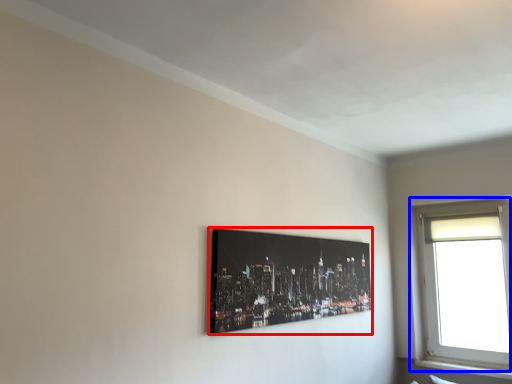
Question: Which object is further to the camera taking this photo, picture frame (highlighted by a red box) or window (highlighted by a blue box)?

Choices:
 (A) picture frame
 (B) window

Answer: (B)